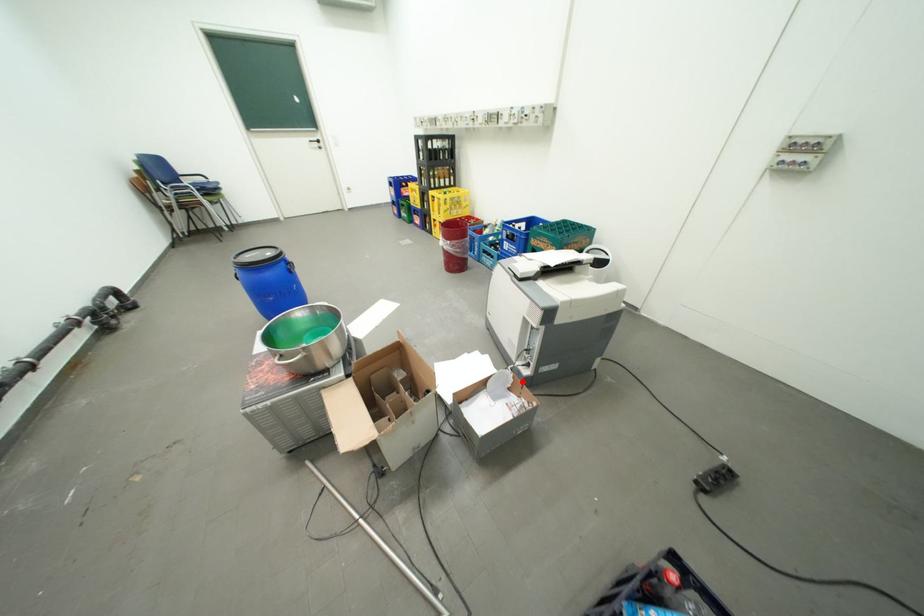
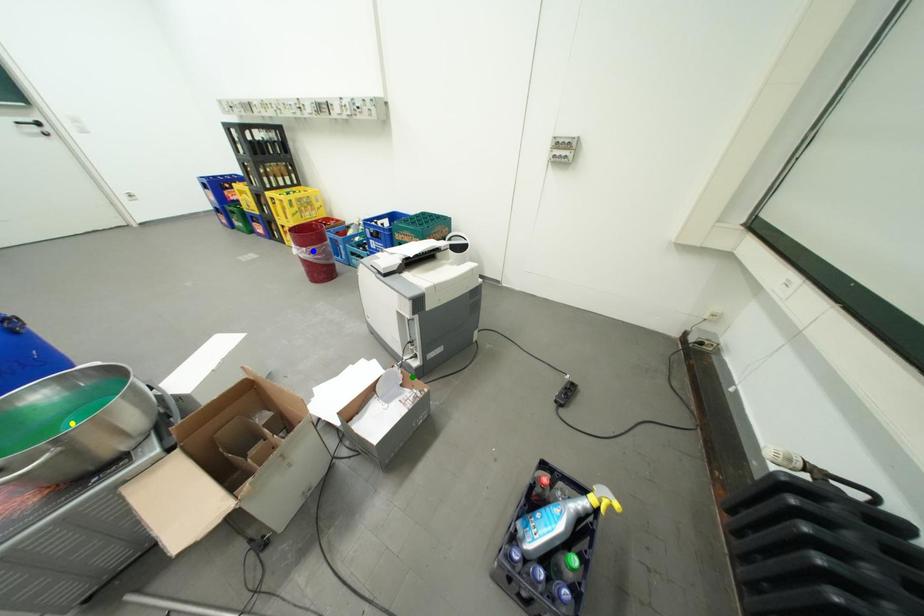
Question: I am providing you with two images of the same scene from different viewpoints. A red point is marked on the first image. You are given multiple points on the second image. Which point in image 2 represents the same 3d spot as the red point in image 1?

Choices:
 (A) green point
 (B) yellow point
 (C) blue point

Answer: (A)